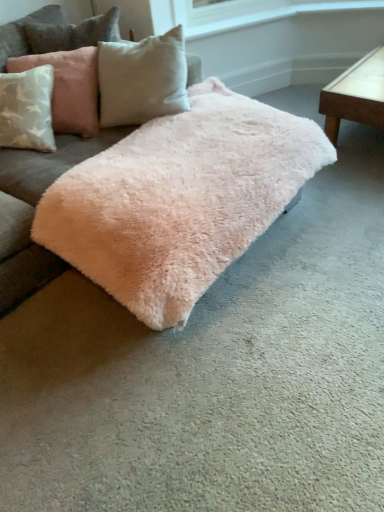
Question: From a real-world perspective, is fuzzy pink rug at center below light brown wooden table at right?

Choices:
 (A) yes
 (B) no

Answer: (B)

Question: Considering the relative sizes of fuzzy pink rug at center and light brown wooden table at right in the image provided, is fuzzy pink rug at center smaller than light brown wooden table at right?

Choices:
 (A) no
 (B) yes

Answer: (A)

Question: Considering the relative sizes of fuzzy pink rug at center and light brown wooden table at right in the image provided, is fuzzy pink rug at center taller than light brown wooden table at right?

Choices:
 (A) yes
 (B) no

Answer: (A)

Question: From a real-world perspective, is fuzzy pink rug at center on light brown wooden table at right?

Choices:
 (A) no
 (B) yes

Answer: (B)

Question: Does fuzzy pink rug at center appear on the left side of light brown wooden table at right?

Choices:
 (A) no
 (B) yes

Answer: (B)

Question: Which is correct: fuzzy pink rug at center is inside light brown wooden table at right, or outside of it?

Choices:
 (A) inside
 (B) outside

Answer: (B)

Question: In the image, is fuzzy pink rug at center on the left side or the right side of light brown wooden table at right?

Choices:
 (A) right
 (B) left

Answer: (B)

Question: From their relative heights in the image, would you say fuzzy pink rug at center is taller or shorter than light brown wooden table at right?

Choices:
 (A) short
 (B) tall

Answer: (B)

Question: Does point (94, 16) appear closer or farther from the camera than point (362, 78)?

Choices:
 (A) farther
 (B) closer

Answer: (A)

Question: Considering the positions of point (347, 93) and point (66, 120), is point (347, 93) closer or farther from the camera than point (66, 120)?

Choices:
 (A) farther
 (B) closer

Answer: (A)

Question: In terms of width, does light brown wooden table at right look wider or thinner when compared to light pink plush pillow at upper left?

Choices:
 (A) wide
 (B) thin

Answer: (A)

Question: From a real-world perspective, is light brown wooden table at right positioned above or below light pink plush pillow at upper left?

Choices:
 (A) below
 (B) above

Answer: (A)

Question: Is light brown wooden table at right to the left or to the right of light pink plush pillow at upper left in the image?

Choices:
 (A) left
 (B) right

Answer: (B)

Question: From the image's perspective, is light pink plush pillow at upper left located above or below fuzzy pink rug at center?

Choices:
 (A) below
 (B) above

Answer: (B)

Question: Is light pink plush pillow at upper left taller or shorter than fuzzy pink rug at center?

Choices:
 (A) short
 (B) tall

Answer: (A)